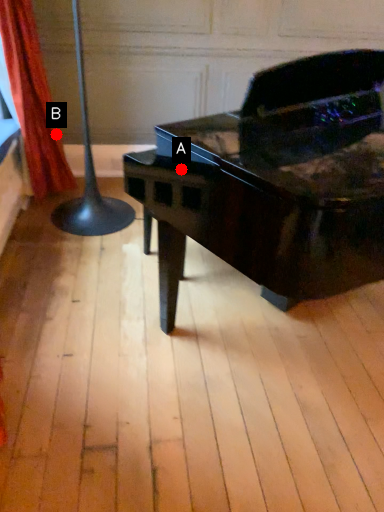
Question: Two points are circled on the image, labeled by A and B beside each circle. Which point is farther to the camera?

Choices:
 (A) A is further
 (B) B is further

Answer: (B)